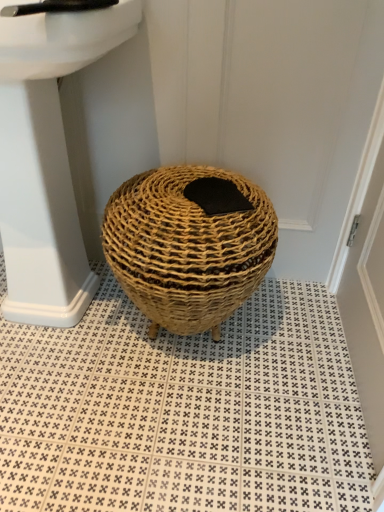
Find the location of a particular element. The width and height of the screenshot is (384, 512). empty space that is ontop of natural woven basket at center (from a real-world perspective) is located at coordinates (195, 193).